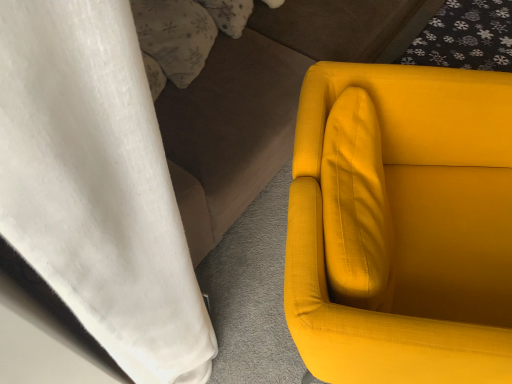
Question: From a real-world perspective, is matte yellow fabric couch at right on matte yellow fabric chair at right?

Choices:
 (A) no
 (B) yes

Answer: (B)

Question: Is matte yellow fabric couch at right to the right of matte yellow fabric chair at right from the viewer's perspective?

Choices:
 (A) no
 (B) yes

Answer: (A)

Question: From a real-world perspective, is matte yellow fabric couch at right under matte yellow fabric chair at right?

Choices:
 (A) yes
 (B) no

Answer: (B)

Question: Is matte yellow fabric chair at right at the back of matte yellow fabric couch at right?

Choices:
 (A) no
 (B) yes

Answer: (A)

Question: Is the depth of matte yellow fabric couch at right less than that of matte yellow fabric chair at right?

Choices:
 (A) yes
 (B) no

Answer: (B)

Question: Is matte yellow fabric couch at right to the left of matte yellow fabric chair at right from the viewer's perspective?

Choices:
 (A) yes
 (B) no

Answer: (A)

Question: Is fluffy white pillow at upper left turned away from matte yellow fabric couch at right?

Choices:
 (A) no
 (B) yes

Answer: (B)

Question: Is fluffy white pillow at upper left to the right of matte yellow fabric couch at right from the viewer's perspective?

Choices:
 (A) no
 (B) yes

Answer: (A)

Question: Can you confirm if fluffy white pillow at upper left is wider than matte yellow fabric couch at right?

Choices:
 (A) no
 (B) yes

Answer: (A)

Question: Is fluffy white pillow at upper left far away from matte yellow fabric couch at right?

Choices:
 (A) no
 (B) yes

Answer: (A)

Question: From the image's perspective, is fluffy white pillow at upper left below matte yellow fabric couch at right?

Choices:
 (A) no
 (B) yes

Answer: (B)

Question: From a real-world perspective, does fluffy white pillow at upper left stand above matte yellow fabric couch at right?

Choices:
 (A) no
 (B) yes

Answer: (B)

Question: Considering the relative sizes of fluffy white pillow at upper left and matte yellow fabric chair at right in the image provided, is fluffy white pillow at upper left thinner than matte yellow fabric chair at right?

Choices:
 (A) no
 (B) yes

Answer: (B)